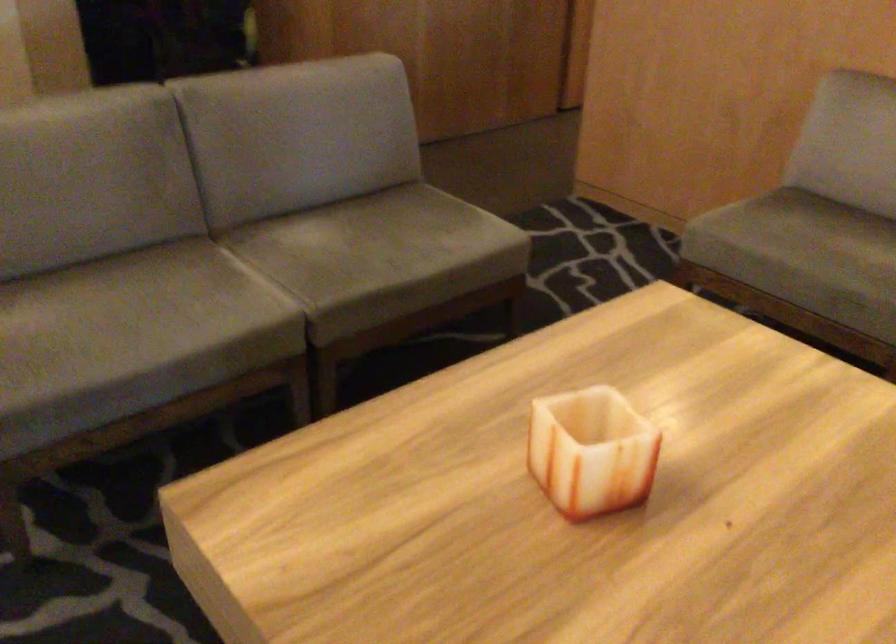
This screenshot has height=644, width=896. In order to click on small white container in this screenshot , I will do `click(590, 451)`.